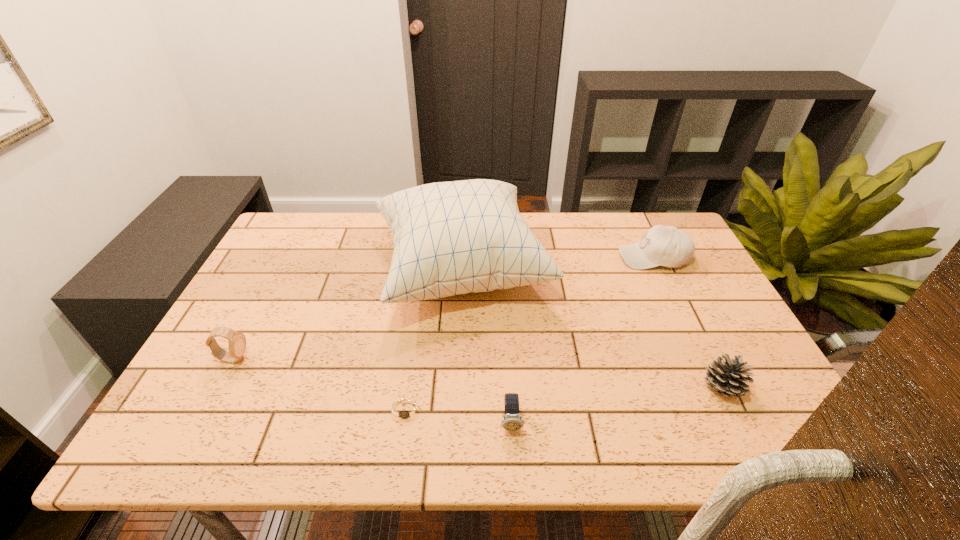
Find the location of `cushion`. cushion is located at coordinates (450, 238).

This screenshot has width=960, height=540. Find the location of `baseball cap`. baseball cap is located at coordinates (668, 246).

The height and width of the screenshot is (540, 960). I want to click on the tallest watch, so click(x=237, y=341).

This screenshot has width=960, height=540. In order to click on the leftmost watch in this screenshot , I will do `click(237, 341)`.

In order to click on pinecone in this screenshot , I will do `click(729, 378)`.

Where is `the second tallest watch`? the second tallest watch is located at coordinates (512, 421).

Identify the location of the rightmost watch. 512,421.

Where is `the shortest watch`? The height and width of the screenshot is (540, 960). the shortest watch is located at coordinates (407, 410).

Image resolution: width=960 pixels, height=540 pixels. Identify the location of the shortest object. (407, 410).

Identify the location of free space located on the right of the tallest object. (628, 271).